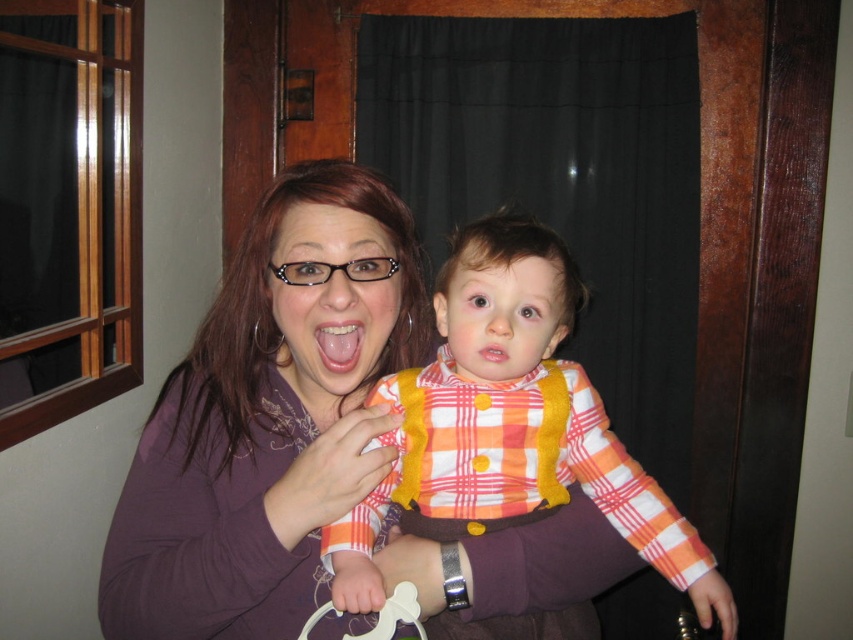
The adult and the child are standing in a room with a wooden door and window. The adult is wearing a purple top and holding the child close. The child is wearing a plaid fabric shirt at center. How far apart are the adult and the child?

The adult and the child are 28.27 inches apart.

You are a fashion designer analyzing the image. You need to determine which object is wider between the matte purple shirt at center and the pink glossy tongue at center. Which one is wider?

The matte purple shirt at center is wider than the pink glossy tongue at center according to the description.

What is located at the coordinates point (265,420)?

The point (265,420) is occupied by the matte purple shirt at center.